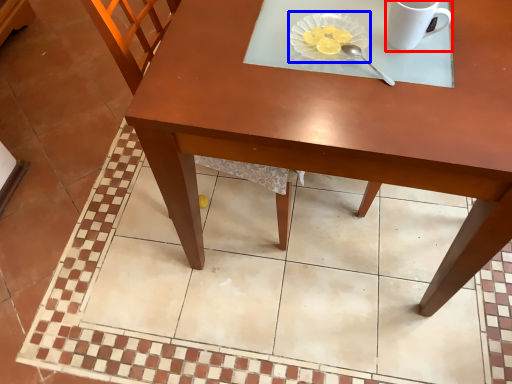
Question: Which object appears farthest to the camera in this image, coffee cup (highlighted by a red box) or glass plate (highlighted by a blue box)?

Choices:
 (A) coffee cup
 (B) glass plate

Answer: (B)